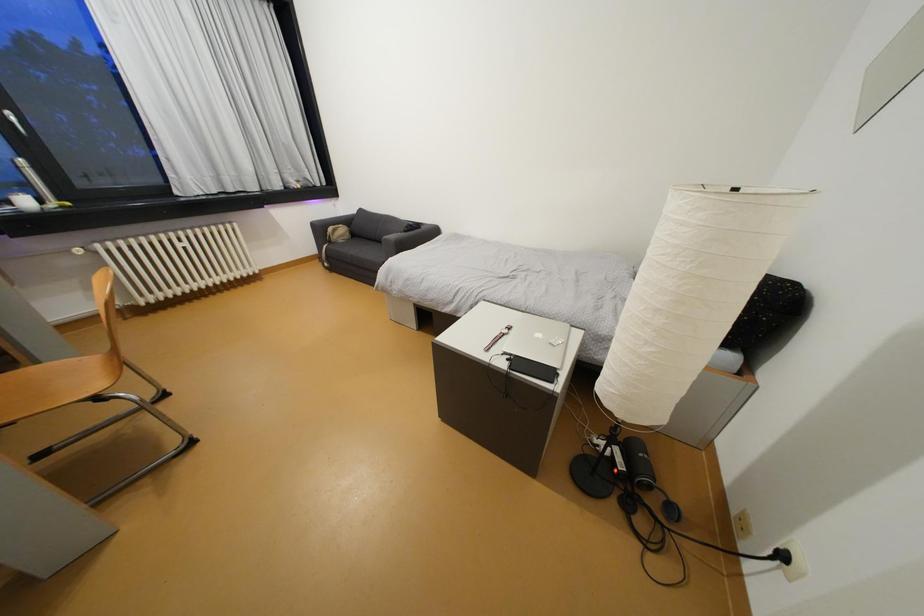
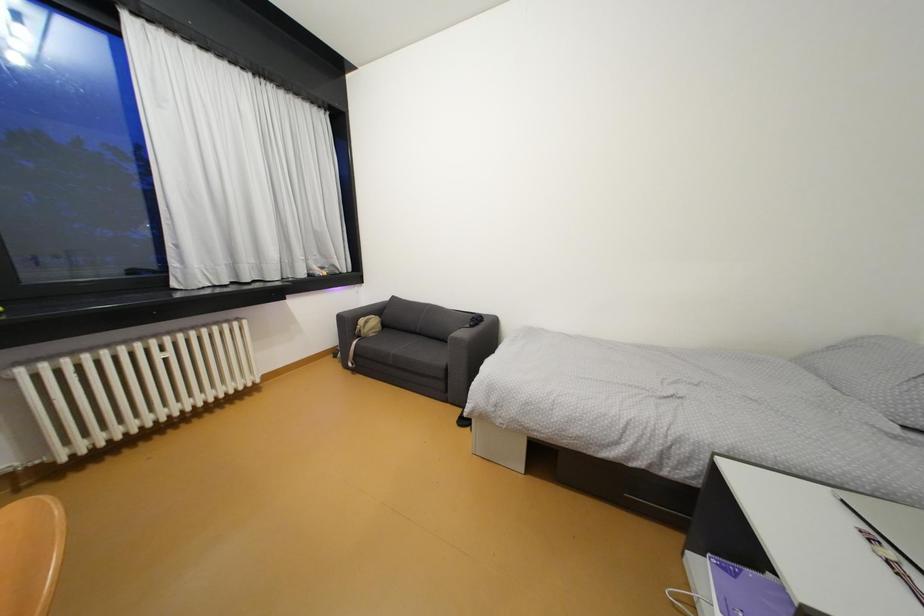
In a continuous first-person perspective shot, in which direction is the camera moving?

The movement direction of the cameraman is left, forward.